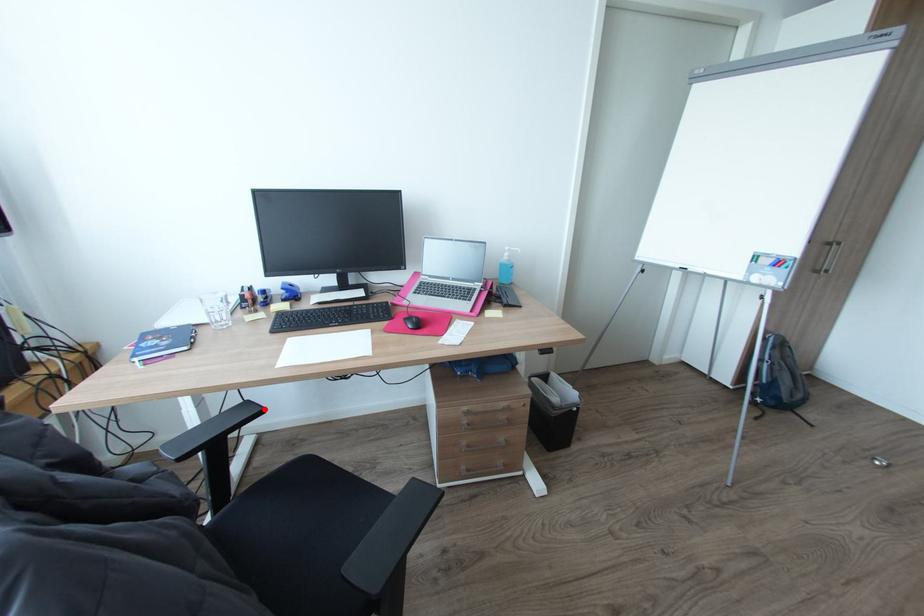
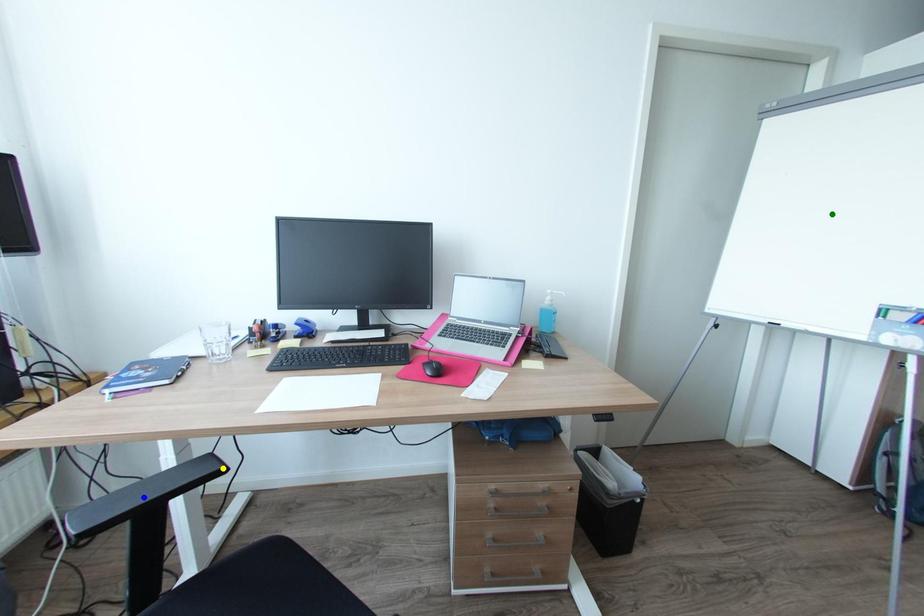
Question: I am providing you with two images of the same scene from different viewpoints. A red point is marked on the first image. You are given multiple points on the second image. In image 2, which mark is for the same physical point as the one in image 1?

Choices:
 (A) green point
 (B) blue point
 (C) yellow point

Answer: (C)